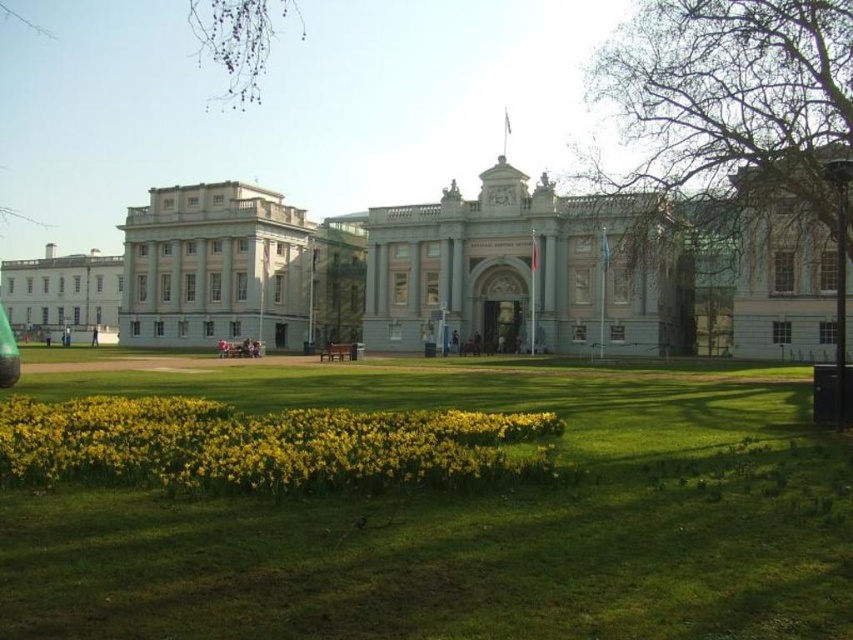
You are standing on the lawn in front of the building and want to take a photo that includes both the green grass at lower center and the smooth gray building at center. Which object will appear larger in the photo?

The smooth gray building at center will appear larger in the photo because it is bigger than the green grass at lower center.

You are standing at the point marked by coordinates point (461,515) in the image. What is the closest object to you in the scene?

The closest object to you at point (461,515) is the green grass at lower center, as you are standing on it.